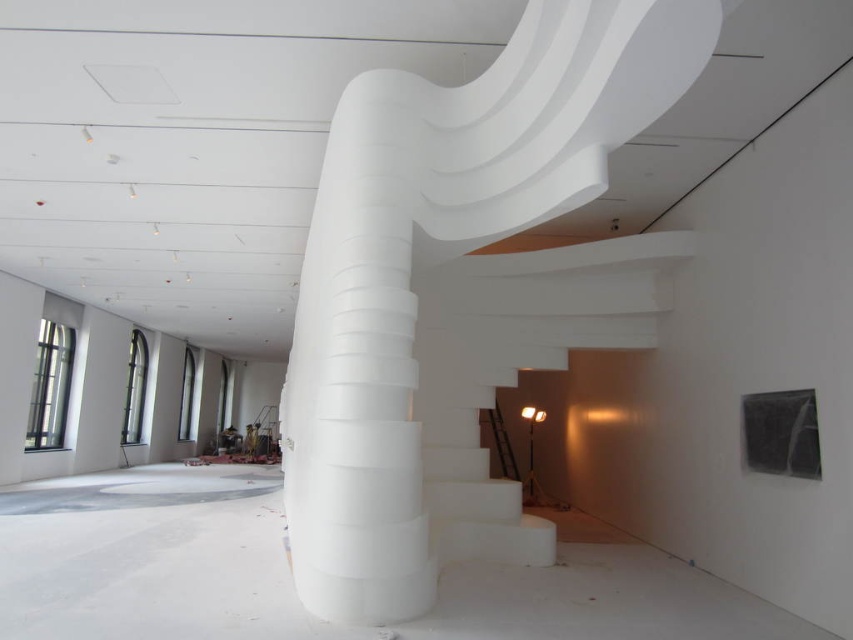
You are standing in the modern interior space and want to move from point A to point B. Point A is at coordinates point (x=450, y=296) and point B is at coordinates point (x=518, y=525). Since the floor is unfinished with scattered debris, you need to know which point is closer to you to avoid walking through debris. Which point is closer to your current position?

Point (x=518, y=525) is closer to your current position because it is less further to the camera than point (x=450, y=296) according to the description.

You are standing in the modern interior space and want to reach a specific point marked as point (374, 592). If your current position is 3 meters away from that point, can you move forward directly to reach it without any obstacles?

The point (374, 592) is 3.45 meters from the viewer. Since you are currently 3 meters away, you are already closer than the specified distance. Therefore, you can move forward directly to reach it as there are no obstacles mentioned in the scene description.